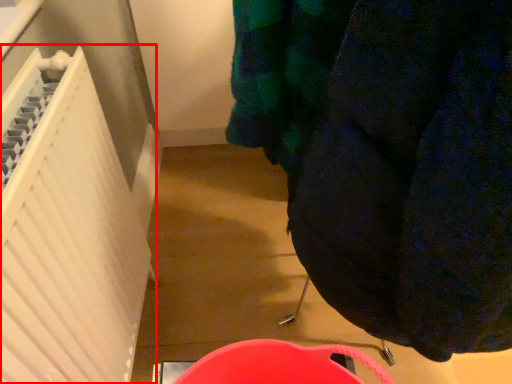
Question: From the image's perspective, what is the correct spatial relationship of radiator (annotated by the red box) in relation to clothing?

Choices:
 (A) above
 (B) below

Answer: (B)